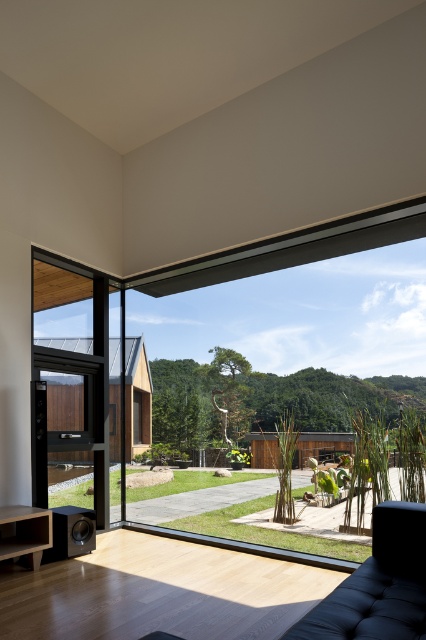
Question: In this image, where is transparent glass window at center located relative to black tufted couch at lower right?

Choices:
 (A) left
 (B) right

Answer: (B)

Question: Is transparent glass window at center further to the viewer compared to transparent wood glass door at left?

Choices:
 (A) no
 (B) yes

Answer: (A)

Question: Is transparent wood glass door at left wider than black tufted couch at lower right?

Choices:
 (A) no
 (B) yes

Answer: (A)

Question: Which point is closer to the camera?

Choices:
 (A) (408, 582)
 (B) (186, 435)

Answer: (A)

Question: Estimate the real-world distances between objects in this image. Which object is closer to the transparent glass window at center?

Choices:
 (A) transparent wood glass door at left
 (B) black tufted couch at lower right

Answer: (A)

Question: Estimate the real-world distances between objects in this image. Which object is closer to the transparent wood glass door at left?

Choices:
 (A) black tufted couch at lower right
 (B) transparent glass window at center

Answer: (A)